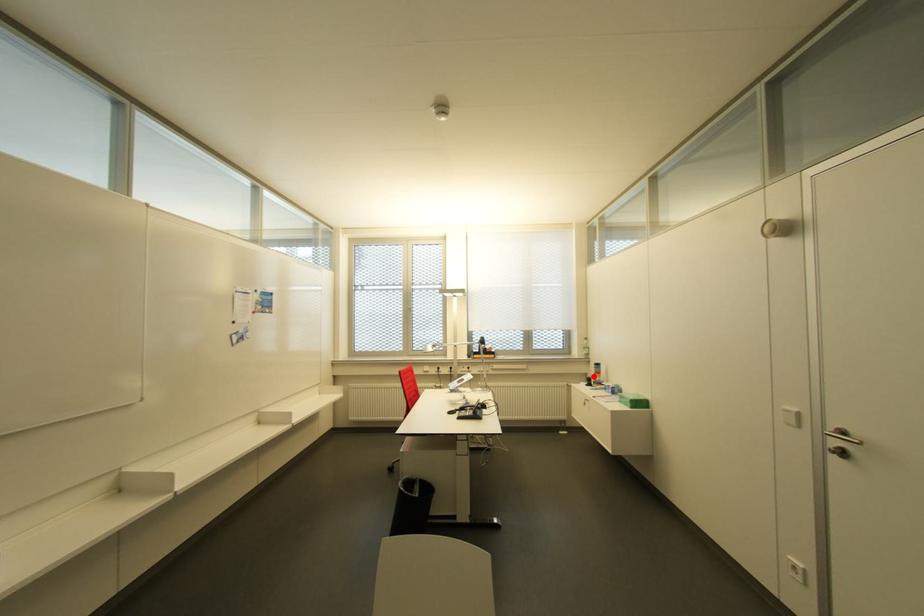
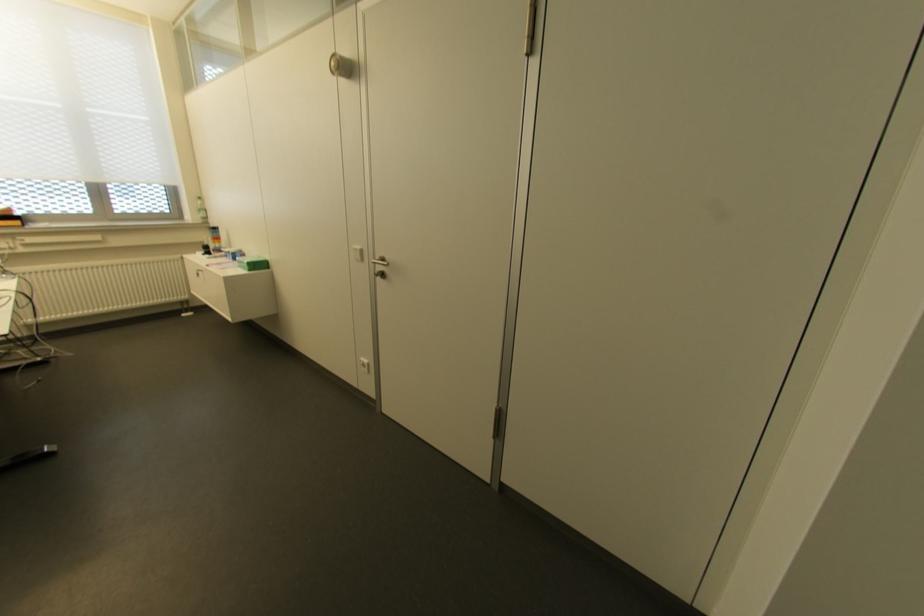
Question: A red point is marked in image1. In image2, is the corresponding 3D point closer to the camera or farther? Reply with the corresponding letter.

Choices:
 (A) The corresponding 3D point is closer.
 (B) The corresponding 3D point is farther.

Answer: (A)